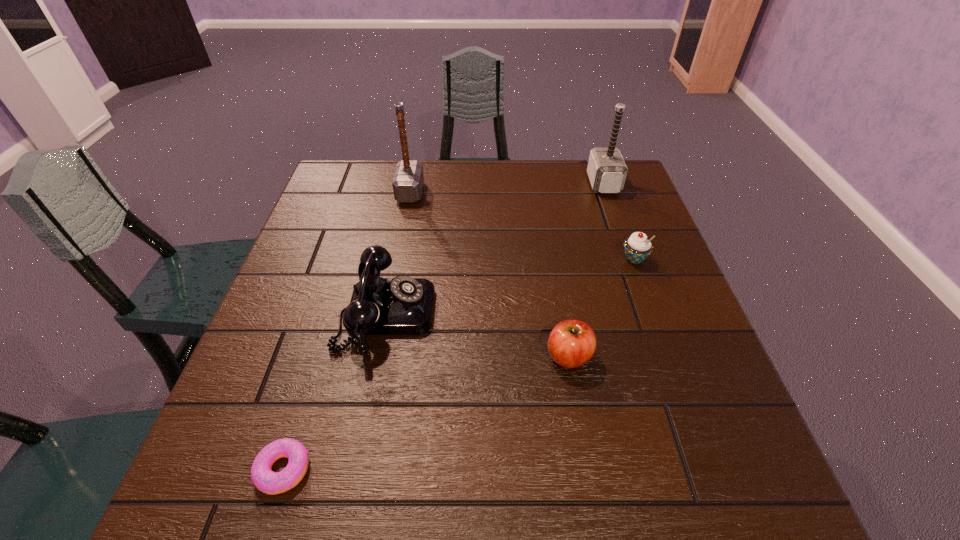
At what (x,y) coordinates should I click in order to perform the action: click on the left hammer. Please return your answer as a coordinate pair (x, y). This screenshot has height=540, width=960. Looking at the image, I should click on (408, 179).

Locate an element on the screen. Image resolution: width=960 pixels, height=540 pixels. the right hammer is located at coordinates (606, 169).

Identify the location of telephone. This screenshot has height=540, width=960. (402, 305).

Identify the location of cupcake. This screenshot has height=540, width=960. (637, 247).

I want to click on the third object from right to left, so click(571, 343).

Locate an element on the screen. The image size is (960, 540). doughnut is located at coordinates (265, 480).

Find the location of a particular element. Image resolution: width=960 pixels, height=540 pixels. the nearest object is located at coordinates (265, 480).

Image resolution: width=960 pixels, height=540 pixels. In order to click on vacant space located on the striking surface of the left hammer in this screenshot , I will do `click(508, 192)`.

Identify the location of free location located for striking with the head of the right hammer. The width and height of the screenshot is (960, 540). (516, 184).

At what (x,y) coordinates should I click in order to perform the action: click on free space located for striking with the head of the right hammer. Please return your answer as a coordinate pair (x, y). This screenshot has width=960, height=540. Looking at the image, I should click on (489, 184).